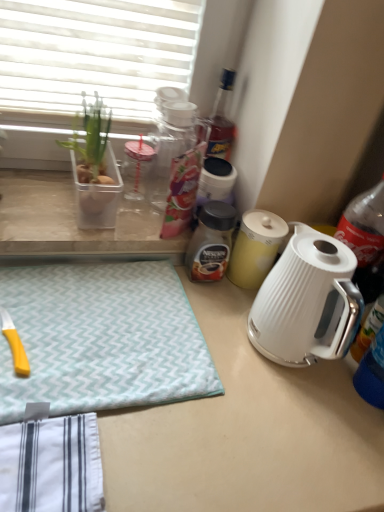
Where is `white glossy electric kettle at center-right`? This screenshot has height=512, width=384. white glossy electric kettle at center-right is located at coordinates (307, 302).

Where is `teal zigzag fabric at lower left`? The width and height of the screenshot is (384, 512). teal zigzag fabric at lower left is located at coordinates (101, 338).

What are the coordinates of `clear plastic container at left` in the screenshot? It's located at (75, 223).

Measure the distance between clear plastic container at upper left and camera.

The depth of clear plastic container at upper left is 36.73 inches.

Locate an element on the screen. This screenshot has height=512, width=384. white glossy electric kettle at center-right is located at coordinates (307, 302).

Is clear plastic container at left to the left or to the right of yellow matte canister at center in the image?

Clearly, clear plastic container at left is on the left of yellow matte canister at center in the image.

What's the angular difference between clear plastic container at left and yellow matte canister at center's facing directions?

clear plastic container at left and yellow matte canister at center are facing 0.966 degrees away from each other.

Is clear plastic container at left bigger or smaller than yellow matte canister at center?

In the image, clear plastic container at left appears to be larger than yellow matte canister at center.

In terms of width, does clear plastic container at left look wider or thinner when compared to yellow matte canister at center?

In the image, clear plastic container at left appears to be wider than yellow matte canister at center.

Can you confirm if yellow matte canister at center is positioned to the left of clear plastic container at upper left?

Incorrect, yellow matte canister at center is not on the left side of clear plastic container at upper left.

Which object is further away from the camera taking this photo, yellow matte canister at center or clear plastic container at upper left?

yellow matte canister at center is behind.

Is yellow matte canister at center turned away from clear plastic container at upper left?

No, clear plastic container at upper left is not at the back of yellow matte canister at center.

Is yellow matte canister at center inside the boundaries of clear plastic container at upper left, or outside?

yellow matte canister at center is located beyond the bounds of clear plastic container at upper left.

Is yellow matte canister at center further to the viewer compared to clear plastic container at left?

That is True.

Is yellow matte canister at center aimed at clear plastic container at left?

No, yellow matte canister at center is not oriented towards clear plastic container at left.

How distant is yellow matte canister at center from clear plastic container at left?

yellow matte canister at center is 31.31 centimeters from clear plastic container at left.

Considering the sizes of objects yellow matte canister at center and clear plastic container at left in the image provided, who is thinner, yellow matte canister at center or clear plastic container at left?

yellow matte canister at center is thinner.

Where is `yoga mat on the right of clear plastic container at left`? The image size is (384, 512). yoga mat on the right of clear plastic container at left is located at coordinates (101, 338).

From the image's perspective, which one is positioned lower, teal zigzag fabric at lower left or clear plastic container at left?

teal zigzag fabric at lower left.

How distant is teal zigzag fabric at lower left from clear plastic container at left?

The distance of teal zigzag fabric at lower left from clear plastic container at left is 7.39 inches.

How different are the orientations of teal zigzag fabric at lower left and clear plastic container at left in degrees?

There is a 1.3-degree angle between the facing directions of teal zigzag fabric at lower left and clear plastic container at left.

From the picture: Is clear plastic container at upper left situated inside white glossy electric kettle at center-right or outside?

The correct answer is: outside.

Which is more to the left, clear plastic container at upper left or white glossy electric kettle at center-right?

clear plastic container at upper left.

From a real-world perspective, does clear plastic container at upper left stand above white glossy electric kettle at center-right?

Correct, in the physical world, clear plastic container at upper left is higher than white glossy electric kettle at center-right.

Does clear plastic container at upper left have a larger size compared to brown glass jar at center?

Yes, clear plastic container at upper left is bigger than brown glass jar at center.

There is a brown glass jar at center. Where is `flowerpot above it (from a real-world perspective)`? The width and height of the screenshot is (384, 512). flowerpot above it (from a real-world perspective) is located at coordinates (98, 195).

Is the surface of clear plastic container at upper left in direct contact with brown glass jar at center?

They are not placed beside each other.

Considering the sizes of objects clear plastic container at upper left and brown glass jar at center in the image provided, who is wider, clear plastic container at upper left or brown glass jar at center?

With larger width is clear plastic container at upper left.

Considering the sizes of objects yellow matte canister at center and teal zigzag fabric at lower left in the image provided, who is taller, yellow matte canister at center or teal zigzag fabric at lower left?

With more height is yellow matte canister at center.

Is point (245, 219) closer to viewer compared to point (44, 321)?

No, it is behind (44, 321).

Is yellow matte canister at center positioned far away from teal zigzag fabric at lower left?

No, yellow matte canister at center is not far from teal zigzag fabric at lower left.

Find the location of a particular element. Image resolution: width=384 pixels, height=512 pixels. window sill below the yellow matte canister at center (from a real-world perspective) is located at coordinates (75, 223).

Locate an element on the screen. The height and width of the screenshot is (512, 384). kitchen appliance located below the clear plastic container at upper left (from the image's perspective) is located at coordinates (255, 248).

Consider the image. Estimate the real-world distances between objects in this image. Which object is closer to yellow matte canister at center, white glossy electric kettle at center-right or clear plastic container at upper left?

white glossy electric kettle at center-right is positioned closer to the anchor yellow matte canister at center.

When comparing their distances from white glossy electric kettle at center-right, does teal zigzag fabric at lower left or clear plastic container at left seem closer?

The object closer to white glossy electric kettle at center-right is teal zigzag fabric at lower left.

From the image, which object appears to be nearer to teal zigzag fabric at lower left, white glossy electric kettle at center-right or brown glass jar at center?

brown glass jar at center lies closer to teal zigzag fabric at lower left than the other object.

Looking at the image, which one is located closer to brown glass jar at center, clear plastic container at left or clear plastic container at upper left?

clear plastic container at left.

When comparing their distances from yellow matte canister at center, does teal zigzag fabric at lower left or clear plastic container at upper left seem closer?

teal zigzag fabric at lower left is positioned closer to the anchor yellow matte canister at center.

When comparing their distances from clear plastic container at left, does brown glass jar at center or white glossy electric kettle at center-right seem closer?

Among the two, brown glass jar at center is located nearer to clear plastic container at left.

From the image, which object appears to be farther from white glossy electric kettle at center-right, white glossy electric kettle at center or clear plastic container at upper left?

clear plastic container at upper left lies further to white glossy electric kettle at center-right than the other object.

Consider the image. When comparing their distances from brown glass jar at center, does clear plastic container at upper left or white glossy electric kettle at center-right seem closer?

white glossy electric kettle at center-right.

Locate an element on the screen. Image resolution: width=384 pixels, height=512 pixels. bottle between clear plastic container at upper left and white glossy electric kettle at center in the vertical direction is located at coordinates (211, 242).

You are a GUI agent. You are given a task and a screenshot of the screen. Output one action in this format:
    pyautogui.click(x=<x>, y=<y>)
    Task: Click on the bottle between clear plastic container at left and yellow matte canister at center in the horizontal direction
    The height and width of the screenshot is (512, 384).
    Given the screenshot: What is the action you would take?
    pyautogui.click(x=211, y=242)

Where is `kitchen appliance between clear plastic container at upper left and white glossy electric kettle at center-right in the horizontal direction`? kitchen appliance between clear plastic container at upper left and white glossy electric kettle at center-right in the horizontal direction is located at coordinates (255, 248).

Locate an element on the screen. The height and width of the screenshot is (512, 384). kitchen appliance between clear plastic container at left and white glossy electric kettle at center-right in the horizontal direction is located at coordinates (255, 248).